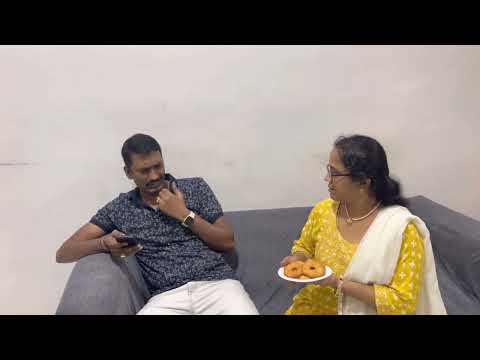
At what (x,y) coordinates should I click in order to perform the action: click on wall. Please return your answer as a coordinate pair (x, y). This screenshot has width=480, height=360. Looking at the image, I should click on (247, 120).